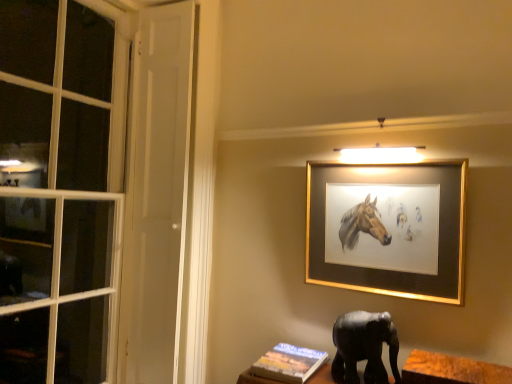
Question: Is gold-framed painting at upper center at the back of black matte elephant at lower right?

Choices:
 (A) yes
 (B) no

Answer: (B)

Question: Is black matte elephant at lower right far away from gold-framed painting at upper center?

Choices:
 (A) no
 (B) yes

Answer: (A)

Question: Is black matte elephant at lower right located outside gold-framed painting at upper center?

Choices:
 (A) no
 (B) yes

Answer: (B)

Question: Is black matte elephant at lower right aimed at gold-framed painting at upper center?

Choices:
 (A) no
 (B) yes

Answer: (A)

Question: From a real-world perspective, is black matte elephant at lower right over gold-framed painting at upper center?

Choices:
 (A) no
 (B) yes

Answer: (A)

Question: Considering the positions of wooden at lower right and gold-framed painting at upper center in the image, is wooden at lower right wider or thinner than gold-framed painting at upper center?

Choices:
 (A) wide
 (B) thin

Answer: (A)

Question: In terms of height, does wooden at lower right look taller or shorter compared to gold-framed painting at upper center?

Choices:
 (A) tall
 (B) short

Answer: (B)

Question: Do you think wooden at lower right is within gold-framed painting at upper center, or outside of it?

Choices:
 (A) outside
 (B) inside

Answer: (A)

Question: Does point (502, 370) appear closer or farther from the camera than point (307, 216)?

Choices:
 (A) farther
 (B) closer

Answer: (B)

Question: Considering their positions, is hardcover book at lower center located in front of or behind wooden at lower right?

Choices:
 (A) behind
 (B) front

Answer: (A)

Question: From the image's perspective, is hardcover book at lower center positioned above or below wooden at lower right?

Choices:
 (A) above
 (B) below

Answer: (B)

Question: Do you think hardcover book at lower center is within wooden at lower right, or outside of it?

Choices:
 (A) outside
 (B) inside

Answer: (A)

Question: Does point (303, 364) appear closer or farther from the camera than point (422, 367)?

Choices:
 (A) farther
 (B) closer

Answer: (A)

Question: Is black matte elephant at lower right spatially inside wooden at lower right, or outside of it?

Choices:
 (A) inside
 (B) outside

Answer: (B)

Question: From the image's perspective, is black matte elephant at lower right located above or below wooden at lower right?

Choices:
 (A) above
 (B) below

Answer: (A)